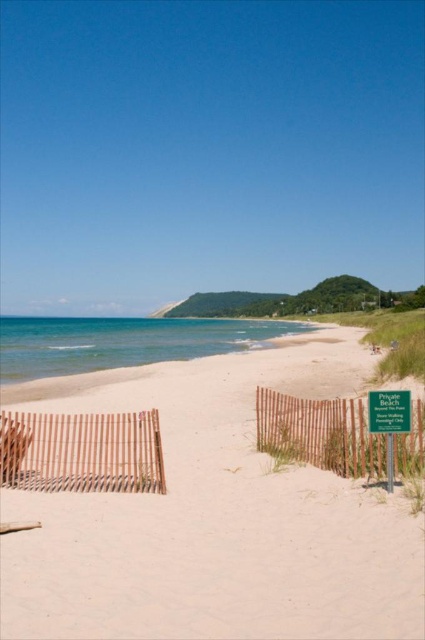
Does white sandy beach at center have a greater width compared to brown wooden fence at lower left?

Correct, the width of white sandy beach at center exceeds that of brown wooden fence at lower left.

In order to click on white sandy beach at center in this screenshot , I will do `click(214, 515)`.

Does white sandy beach at center have a larger size compared to green plastic sign at lower right?

Yes.

Does white sandy beach at center appear on the left side of green plastic sign at lower right?

Indeed, white sandy beach at center is positioned on the left side of green plastic sign at lower right.

Image resolution: width=425 pixels, height=640 pixels. Find the location of `white sandy beach at center`. white sandy beach at center is located at coordinates (214, 515).

Does green plastic sign at lower right have a lesser width compared to wooden slats at lower left?

No, green plastic sign at lower right is not thinner than wooden slats at lower left.

Who is shorter, green plastic sign at lower right or wooden slats at lower left?

Standing shorter between the two is green plastic sign at lower right.

Which is behind, point (382, 403) or point (16, 429)?

Point (16, 429)

I want to click on green plastic sign at lower right, so click(x=388, y=412).